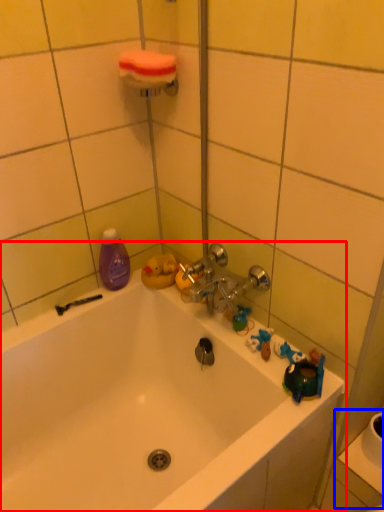
Question: Which object is closer to the camera taking this photo, bathtub (highlighted by a red box) or sink (highlighted by a blue box)?

Choices:
 (A) bathtub
 (B) sink

Answer: (A)